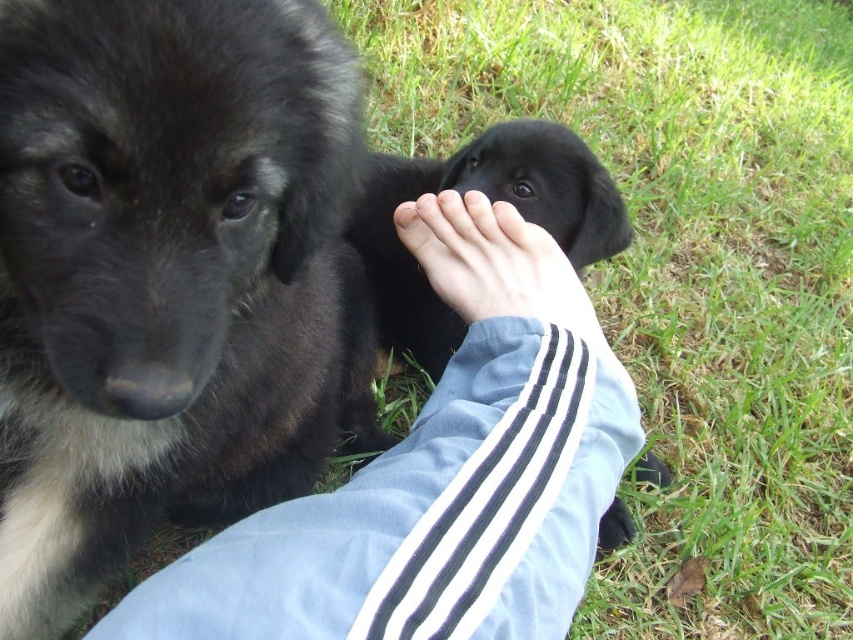
Question: Which object is positioned closest to the green grass at lower right?

Choices:
 (A) light blue fabric at center
 (B) black fur dog at center
 (C) skinny white hand at center
 (D) black fur paw at lower center

Answer: (B)

Question: Can you confirm if light blue fabric at center is positioned to the right of black fur dog at center?

Choices:
 (A) yes
 (B) no

Answer: (B)

Question: Does black fur dog at center appear over black fur paw at lower center?

Choices:
 (A) no
 (B) yes

Answer: (B)

Question: Which object is farther from the camera taking this photo?

Choices:
 (A) light blue fabric at center
 (B) skinny white hand at center

Answer: (B)

Question: Can you confirm if light blue fabric at center is positioned to the left of skinny white hand at center?

Choices:
 (A) yes
 (B) no

Answer: (A)

Question: Based on their relative distances, which object is nearer to the skinny white hand at center?

Choices:
 (A) green grass at lower right
 (B) light blue fabric at center
 (C) black fur dog at center

Answer: (B)